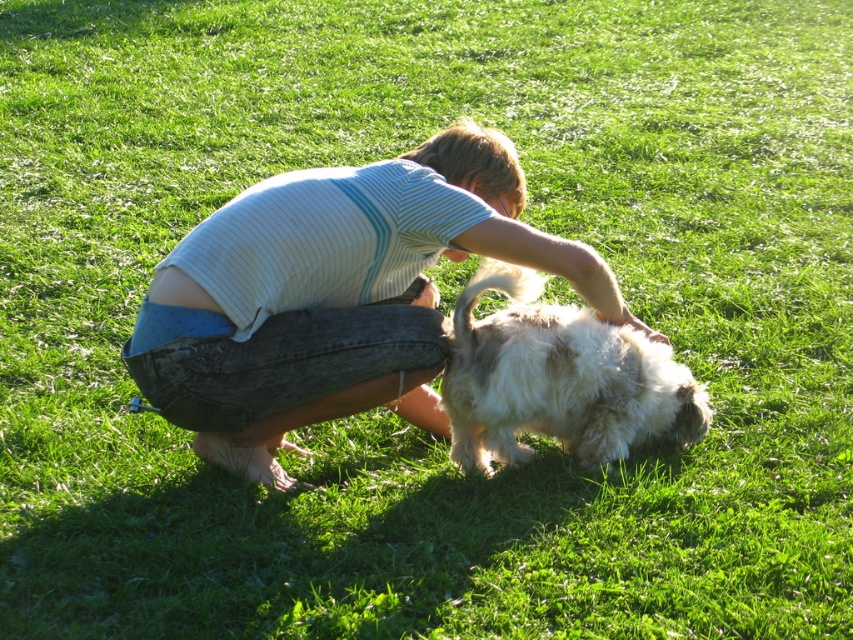
You are standing at the point marked as point (637, 413) and want to walk towards the point marked as point (456, 177). Which direction should you move to get closer to your destination?

You should move towards the point (456, 177) because it is closer to the viewer than point (637, 413). Since you are at point (637, 413), moving towards the viewer would bring you closer to point (456, 177).

You are a photographer standing 2.5 meters away from the camera. You want to take a photo of the light blue striped shirt at center. Can you reach the camera to adjust it?

The light blue striped shirt at center and camera are 3.15 meters apart. Since you are 2.5 meters away from the camera, you are closer to the camera than the shirt. You can easily reach the camera to adjust it.

What are the coordinates of the light blue striped shirt at center?

The coordinates of the light blue striped shirt at center are at point (335, 296).